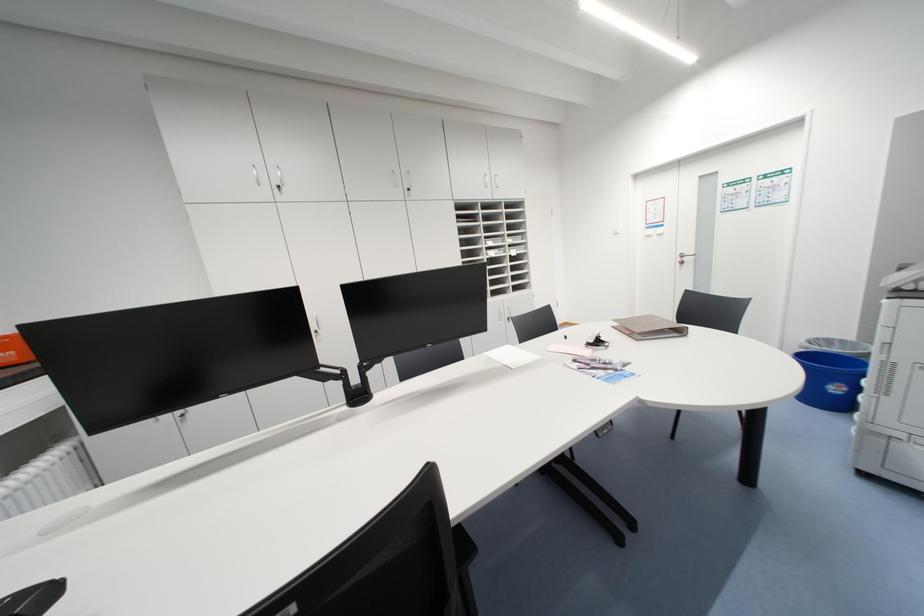
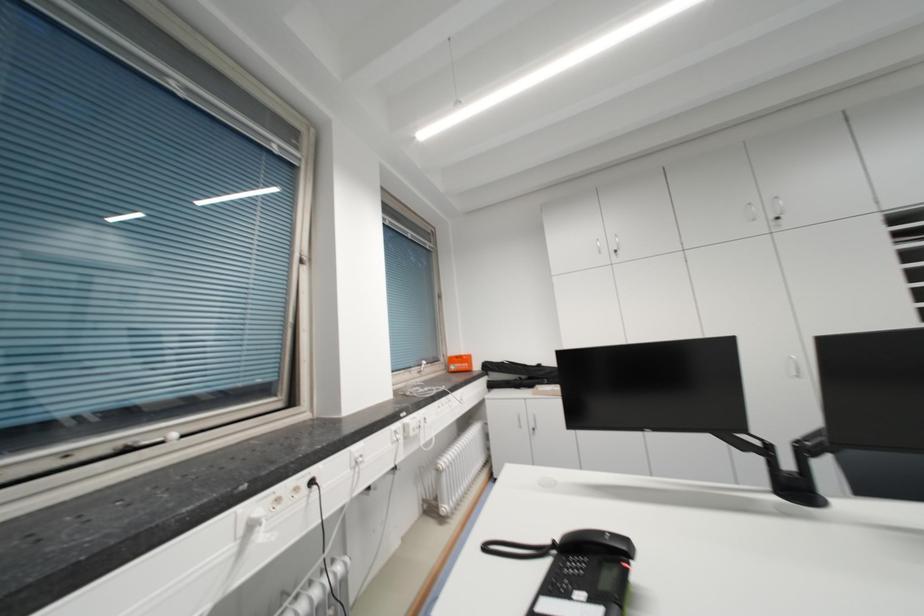
Question: The first image is from the beginning of the video and the second image is from the end. How did the camera likely rotate when shooting the video?

Choices:
 (A) Left
 (B) Right
 (C) Up
 (D) Down

Answer: (A)